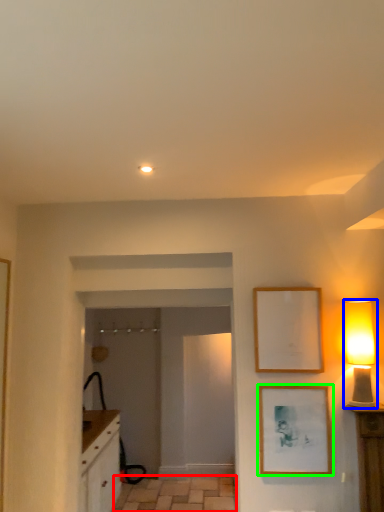
Question: Estimate the real-world distances between objects in this image. Which object is closer to tile (highlighted by a red box), table lamp (highlighted by a blue box) or picture frame (highlighted by a green box)?

Choices:
 (A) table lamp
 (B) picture frame

Answer: (B)